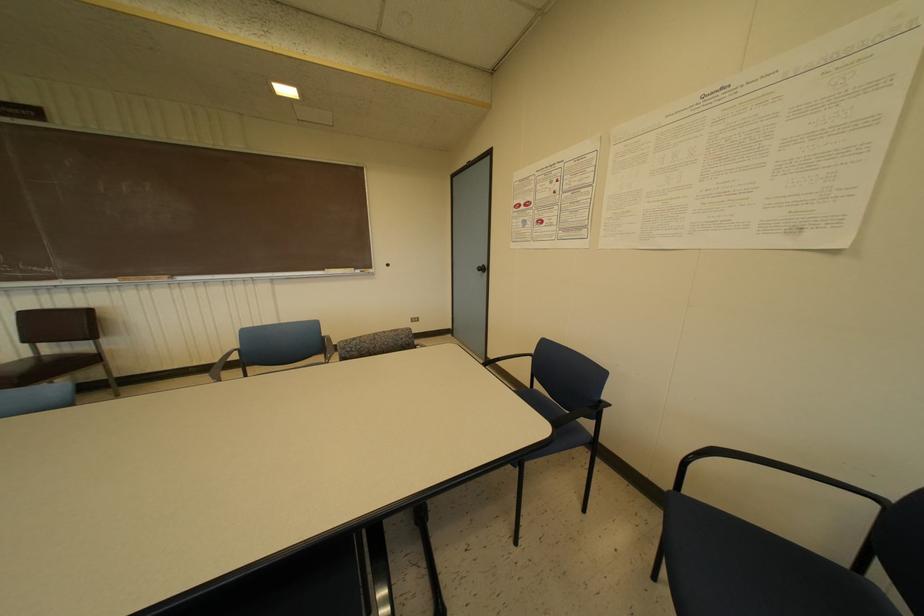
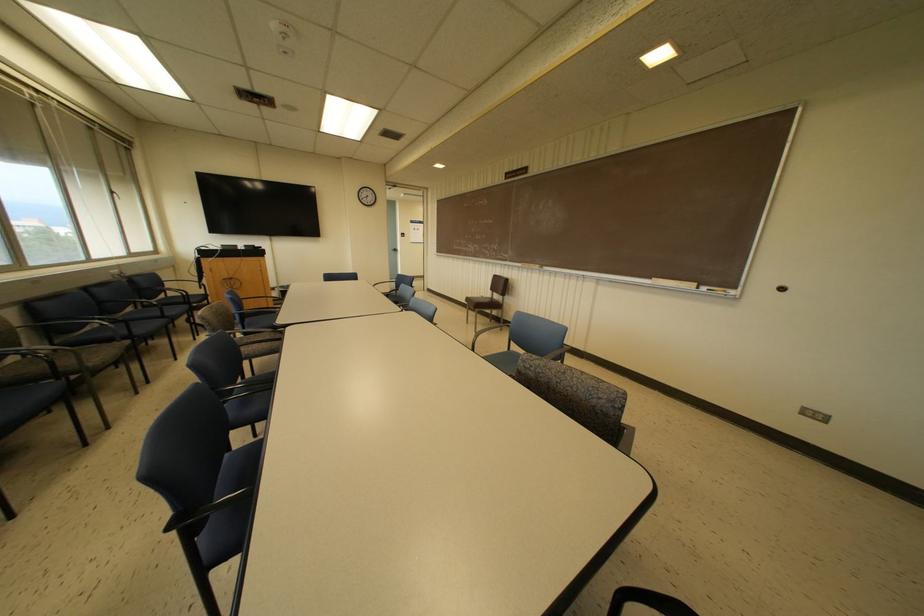
In the second image, find the point that corresponds to the point at 386,265 in the first image.

(783, 288)